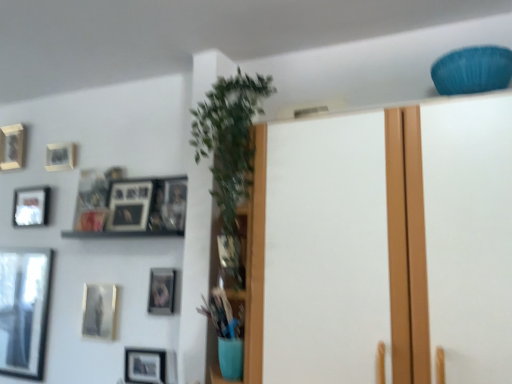
Question: Is matte gold picture frame at upper left, the fourth picture frame in the left-to-right sequence, a part of matte gold picture frame at center-left, acting as the 8th picture frame starting from the left?

Choices:
 (A) yes
 (B) no

Answer: (B)

Question: Does matte gold picture frame at center-left, arranged as the 1th picture frame when viewed from the right, lie behind matte gold picture frame at upper left, the fourth picture frame in the left-to-right sequence?

Choices:
 (A) yes
 (B) no

Answer: (B)

Question: Is matte gold picture frame at center-left, acting as the 8th picture frame starting from the left, at the right side of matte gold picture frame at upper left, the fourth picture frame in the left-to-right sequence?

Choices:
 (A) no
 (B) yes

Answer: (B)

Question: Can you confirm if matte gold picture frame at center-left, arranged as the 1th picture frame when viewed from the right, is thinner than matte gold picture frame at upper left, the 5th picture frame positioned from the right?

Choices:
 (A) yes
 (B) no

Answer: (A)

Question: Does matte gold picture frame at center-left, acting as the 8th picture frame starting from the left, appear on the left side of matte gold picture frame at upper left, the 5th picture frame positioned from the right?

Choices:
 (A) no
 (B) yes

Answer: (A)

Question: From the image's perspective, is matte gold picture frame at center-left, acting as the 8th picture frame starting from the left, below matte gold picture frame at upper left, the fourth picture frame in the left-to-right sequence?

Choices:
 (A) yes
 (B) no

Answer: (A)

Question: Considering the relative sizes of green leafy plant at center and matte black picture frame at lower center, marked as the 2th picture frame in a right-to-left arrangement, in the image provided, is green leafy plant at center smaller than matte black picture frame at lower center, marked as the 2th picture frame in a right-to-left arrangement,?

Choices:
 (A) yes
 (B) no

Answer: (B)

Question: From a real-world perspective, is green leafy plant at center physically above matte black picture frame at lower center, marked as the 2th picture frame in a right-to-left arrangement?

Choices:
 (A) yes
 (B) no

Answer: (A)

Question: Is green leafy plant at center not inside matte black picture frame at lower center, marked as the seventh picture frame in a left-to-right arrangement?

Choices:
 (A) no
 (B) yes

Answer: (B)

Question: Is the depth of green leafy plant at center greater than that of matte black picture frame at lower center, marked as the 2th picture frame in a right-to-left arrangement?

Choices:
 (A) no
 (B) yes

Answer: (A)

Question: Is green leafy plant at center beside matte black picture frame at lower center, marked as the 2th picture frame in a right-to-left arrangement?

Choices:
 (A) no
 (B) yes

Answer: (A)

Question: Is green leafy plant at center closer to the viewer compared to matte black picture frame at lower center, marked as the seventh picture frame in a left-to-right arrangement?

Choices:
 (A) no
 (B) yes

Answer: (B)

Question: Considering the relative sizes of matte gold picture frame at upper left, the 5th picture frame positioned from the right, and matte gold picture frame at center-left, arranged as the 1th picture frame when viewed from the right, in the image provided, is matte gold picture frame at upper left, the 5th picture frame positioned from the right, smaller than matte gold picture frame at center-left, arranged as the 1th picture frame when viewed from the right,?

Choices:
 (A) yes
 (B) no

Answer: (B)